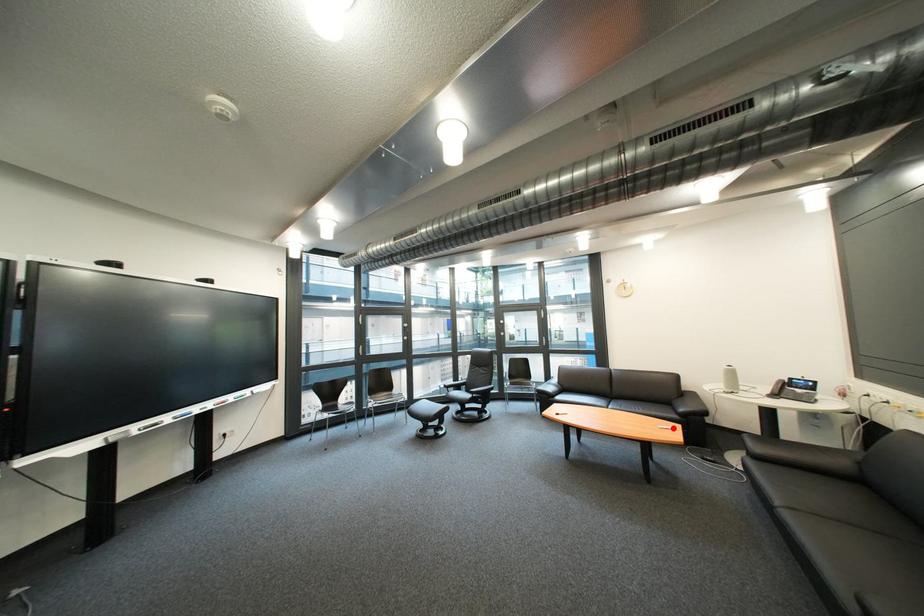
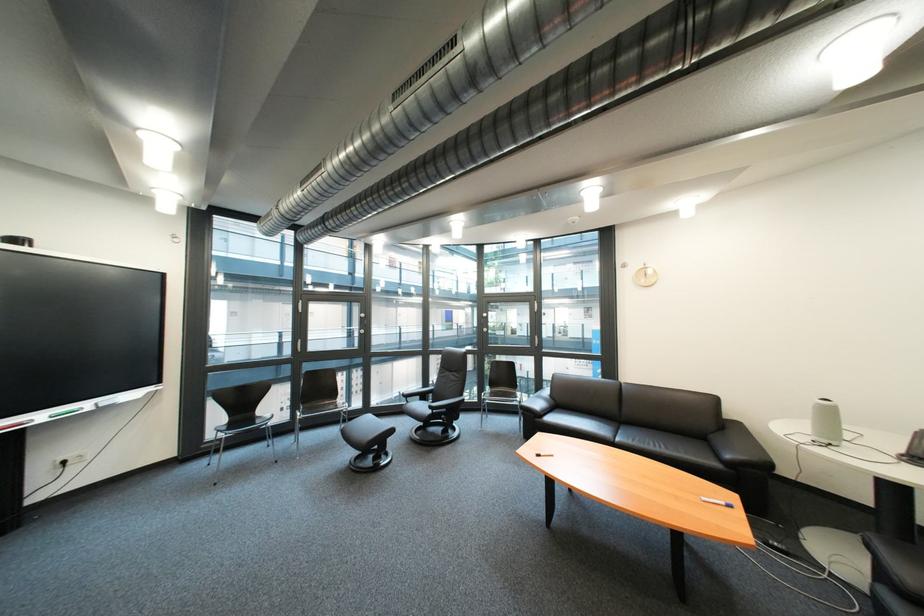
Locate, in the second image, the point that corresponds to the highlighted location in the first image.

(718, 501)